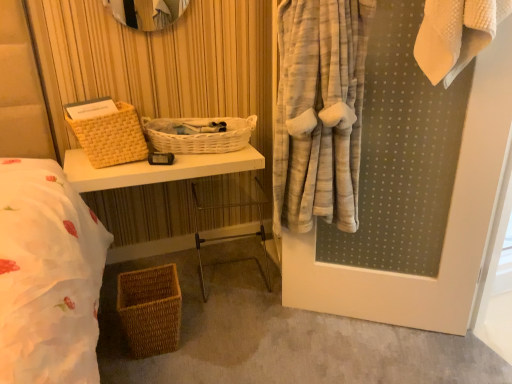
Question: In terms of size, does woven wicker basket at left, which is the second basket in bottom-to-top order, appear bigger or smaller than woven wood table at center?

Choices:
 (A) small
 (B) big

Answer: (A)

Question: From the image's perspective, is woven wicker basket at left, which ranks as the second basket in top-to-bottom order, above or below woven wood table at center?

Choices:
 (A) above
 (B) below

Answer: (A)

Question: Which is nearer to the white wicker basket at center, the third basket positioned from the bottom?

Choices:
 (A) woven wicker basket at left, which ranks as the second basket in top-to-bottom order
 (B) clear plastic chair at center
 (C) woven brown basket at lower left, marked as the first basket in a bottom-to-top arrangement
 (D) woven wood table at center

Answer: (D)

Question: Estimate the real-world distances between objects in this image. Which object is farther from the clear plastic chair at center?

Choices:
 (A) woven brown basket at lower left, marked as the first basket in a bottom-to-top arrangement
 (B) woven wood table at center
 (C) woven wicker basket at left, which ranks as the second basket in top-to-bottom order
 (D) white wicker basket at center, which ranks as the first basket in top-to-bottom order

Answer: (A)